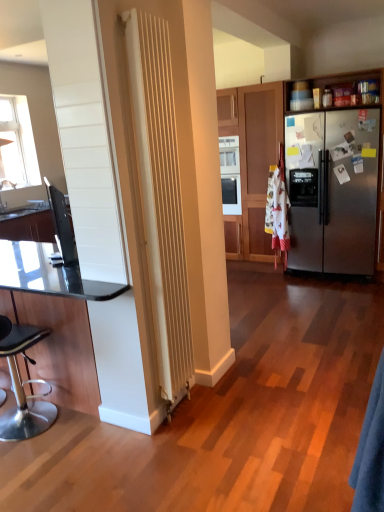
Question: Considering the relative sizes of black leather stool at lower left and black laminate countertop at left in the image provided, is black leather stool at lower left shorter than black laminate countertop at left?

Choices:
 (A) yes
 (B) no

Answer: (B)

Question: From a real-world perspective, does black leather stool at lower left stand above black laminate countertop at left?

Choices:
 (A) no
 (B) yes

Answer: (A)

Question: From the image's perspective, does black leather stool at lower left appear higher than black laminate countertop at left?

Choices:
 (A) no
 (B) yes

Answer: (A)

Question: Is black laminate countertop at left a part of black leather stool at lower left?

Choices:
 (A) no
 (B) yes

Answer: (A)

Question: Is black leather stool at lower left not inside black laminate countertop at left?

Choices:
 (A) no
 (B) yes

Answer: (B)

Question: Looking at the image, does black laminate countertop at left seem bigger or smaller compared to stainless steel refrigerator at right?

Choices:
 (A) small
 (B) big

Answer: (A)

Question: In terms of height, does black laminate countertop at left look taller or shorter compared to stainless steel refrigerator at right?

Choices:
 (A) tall
 (B) short

Answer: (B)

Question: From a real-world perspective, is black laminate countertop at left above or below stainless steel refrigerator at right?

Choices:
 (A) above
 (B) below

Answer: (B)

Question: Would you say black laminate countertop at left is inside or outside stainless steel refrigerator at right?

Choices:
 (A) inside
 (B) outside

Answer: (B)

Question: From a real-world perspective, is black leather stool at lower left physically located above or below transparent glass table at left?

Choices:
 (A) below
 (B) above

Answer: (A)

Question: Is black leather stool at lower left spatially inside transparent glass table at left, or outside of it?

Choices:
 (A) inside
 (B) outside

Answer: (A)

Question: From the image's perspective, is black leather stool at lower left positioned above or below transparent glass table at left?

Choices:
 (A) above
 (B) below

Answer: (B)

Question: Is black leather stool at lower left bigger or smaller than transparent glass table at left?

Choices:
 (A) small
 (B) big

Answer: (A)

Question: Considering the positions of stainless steel refrigerator at right and black leather stool at lower left in the image, is stainless steel refrigerator at right wider or thinner than black leather stool at lower left?

Choices:
 (A) thin
 (B) wide

Answer: (B)

Question: Is stainless steel refrigerator at right to the left or to the right of black leather stool at lower left in the image?

Choices:
 (A) right
 (B) left

Answer: (A)